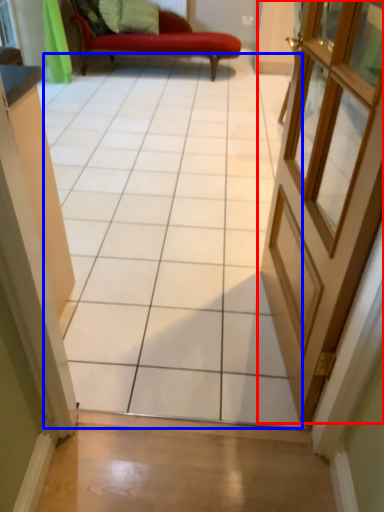
Question: Which of the following is the closest to the observer, door (highlighted by a red box) or ceramic tile (highlighted by a blue box)?

Choices:
 (A) door
 (B) ceramic tile

Answer: (B)